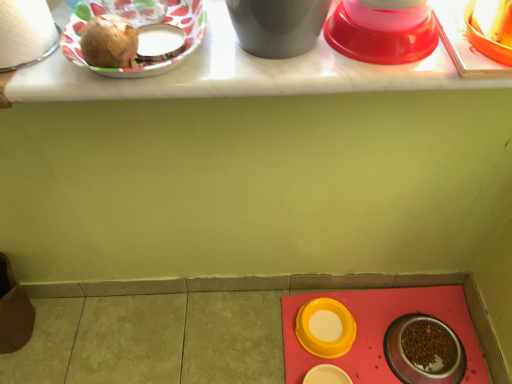
I want to click on blank space to the left of metallic silver bowl at lower right, which is the second tableware from bottom to top, so click(367, 356).